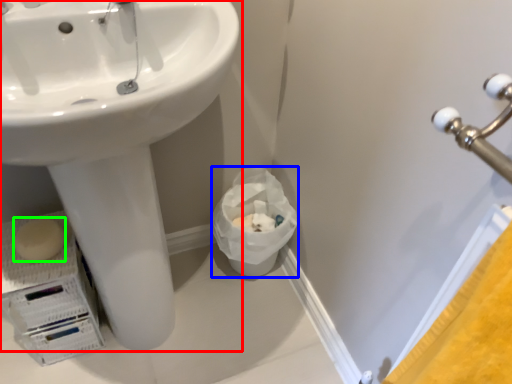
Question: Which is nearer to the sink (highlighted by a red box)? garbage (highlighted by a blue box) or soap (highlighted by a green box).

Choices:
 (A) garbage
 (B) soap

Answer: (B)